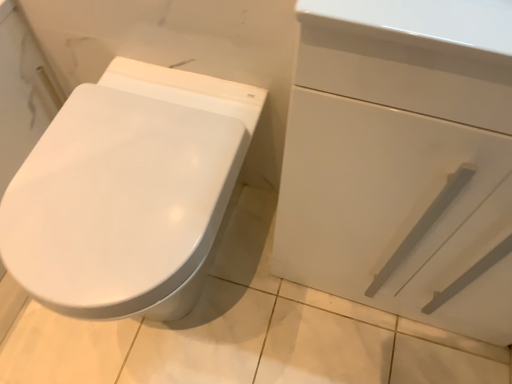
The image size is (512, 384). What are the coordinates of `white glossy bidet at left` in the screenshot? It's located at [121, 205].

Measure the distance between white glossy bidet at left and camera.

They are 24.70 inches apart.

Image resolution: width=512 pixels, height=384 pixels. Describe the element at coordinates (121, 205) in the screenshot. I see `white glossy bidet at left` at that location.

Image resolution: width=512 pixels, height=384 pixels. What are the coordinates of `white glossy drawer at right` in the screenshot? It's located at (394, 210).

What do you see at coordinates (394, 210) in the screenshot?
I see `white glossy drawer at right` at bounding box center [394, 210].

The width and height of the screenshot is (512, 384). Find the location of `white glossy bidet at left`. white glossy bidet at left is located at coordinates (121, 205).

Which is more to the left, white glossy bidet at left or white glossy drawer at right?

white glossy bidet at left.

Does white glossy bidet at left lie in front of white glossy drawer at right?

That is False.

Is point (87, 225) farther from viewer compared to point (477, 258)?

That is False.

From the image's perspective, which object appears higher, white glossy bidet at left or white glossy drawer at right?

white glossy drawer at right.

From a real-world perspective, is white glossy bidet at left on white glossy drawer at right?

Actually, white glossy bidet at left is physically below white glossy drawer at right in the real world.

Which of these two, white glossy bidet at left or white glossy drawer at right, is wider?

With larger width is white glossy bidet at left.

Who is shorter, white glossy bidet at left or white glossy drawer at right?

white glossy bidet at left.

Considering the relative sizes of white glossy bidet at left and white glossy drawer at right in the image provided, is white glossy bidet at left smaller than white glossy drawer at right?

Yes, white glossy bidet at left is smaller than white glossy drawer at right.

Can we say white glossy bidet at left lies outside white glossy drawer at right?

white glossy bidet at left lies outside white glossy drawer at right's area.

Is white glossy bidet at left directly adjacent to white glossy drawer at right?

No, white glossy bidet at left is not next to white glossy drawer at right.

Could you tell me if white glossy bidet at left is turned towards white glossy drawer at right?

No, white glossy bidet at left is not facing towards white glossy drawer at right.

What's the angular difference between white glossy bidet at left and white glossy drawer at right's facing directions?

The angle between the facing direction of white glossy bidet at left and the facing direction of white glossy drawer at right is 0.773 degrees.

Find the location of a particular element. bidet behind the white glossy drawer at right is located at coordinates (121, 205).

Does white glossy drawer at right appear on the right side of white glossy bidet at left?

Correct, you'll find white glossy drawer at right to the right of white glossy bidet at left.

Considering their positions, is white glossy drawer at right located in front of or behind white glossy bidet at left?

Clearly, white glossy drawer at right is in front of white glossy bidet at left.

Considering the positions of point (367, 226) and point (49, 290), is point (367, 226) closer or farther from the camera than point (49, 290)?

Point (367, 226) appears to be farther away from the viewer than point (49, 290).

From the image's perspective, between white glossy drawer at right and white glossy bidet at left, which one is located above?

white glossy drawer at right is shown above in the image.

From a real-world perspective, is white glossy drawer at right under white glossy bidet at left?

No, from a real-world perspective, white glossy drawer at right is not beneath white glossy bidet at left.

Can you confirm if white glossy drawer at right is thinner than white glossy bidet at left?

Correct, the width of white glossy drawer at right is less than that of white glossy bidet at left.

Is white glossy drawer at right taller than white glossy bidet at left?

Yes.

Which of these two, white glossy drawer at right or white glossy bidet at left, is smaller?

white glossy bidet at left.

Choose the correct answer: Is white glossy drawer at right inside white glossy bidet at left or outside it?

white glossy drawer at right is not inside white glossy bidet at left, it's outside.

Is white glossy drawer at right not near white glossy bidet at left?

They are positioned close to each other.

Is white glossy drawer at right oriented away from white glossy bidet at left?

No, white glossy bidet at left is not at the back of white glossy drawer at right.

How distant is white glossy drawer at right from white glossy bidet at left?

white glossy drawer at right is 12.25 inches away from white glossy bidet at left.

You are a GUI agent. You are given a task and a screenshot of the screen. Output one action in this format:
    pyautogui.click(x=<x>, y=<y>)
    Task: Click on the drawer above the white glossy bidet at left (from the image's perspective)
    This screenshot has height=384, width=512.
    Given the screenshot: What is the action you would take?
    pyautogui.click(x=394, y=210)

Locate an element on the screen. Image resolution: width=512 pixels, height=384 pixels. drawer that appears above the white glossy bidet at left (from a real-world perspective) is located at coordinates (394, 210).

Where is `drawer that is in front of the white glossy bidet at left`? The width and height of the screenshot is (512, 384). drawer that is in front of the white glossy bidet at left is located at coordinates (394, 210).